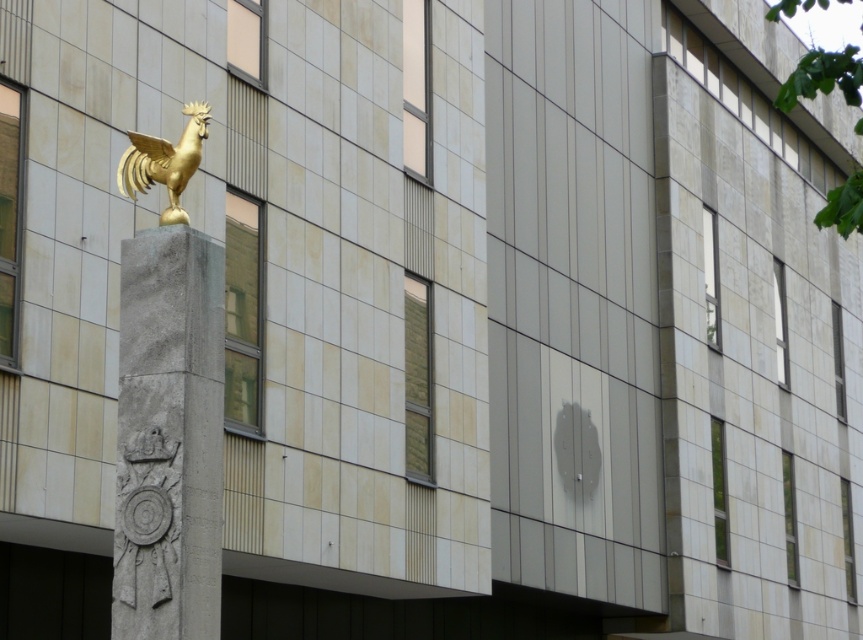
You are an architect designing a new building and want to place a decorative element similar to the gold metallic rooster at upper left next to the gray stone column at center. Based on their sizes, which one should be placed first to ensure proper spacing?

The gray stone column at center is wider than the gold metallic rooster at upper left, so it should be placed first to ensure there is enough space for both elements.

You are standing in front of the modern building with the golden rooster statue on the pedestal. There are two points marked on the ground in front of you. The first point is at coordinate point (193, 493), and the second is at point (134, 188). Which point is closer to you?

Point (193, 493) is in front of point (134, 188), so it is closer to you.